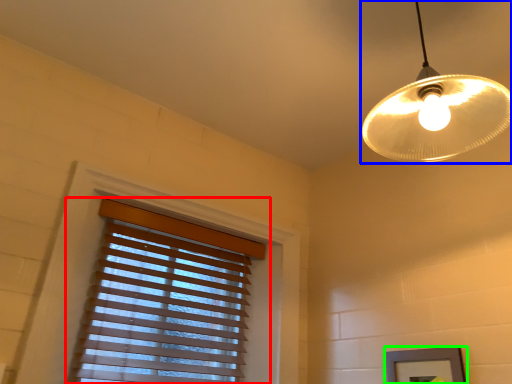
Question: Which is farther away from window blind (highlighted by a red box)? lamp (highlighted by a blue box) or picture frame (highlighted by a green box)?

Choices:
 (A) lamp
 (B) picture frame

Answer: (A)